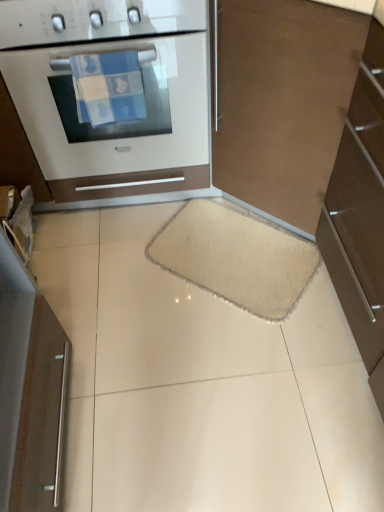
In order to face beige fuzzy mat at center, should I rotate leftwards or rightwards?

You should rotate right by 5.281 degrees.

You are a GUI agent. You are given a task and a screenshot of the screen. Output one action in this format:
    pyautogui.click(x=<x>, y=<y>)
    Task: Click on the metallic silver fridge at left
    The image size is (384, 512).
    Given the screenshot: What is the action you would take?
    pyautogui.click(x=42, y=416)

Which is nearer, (354, 121) or (59, 442)?

Clearly, point (354, 121) is closer to the camera than point (59, 442).

From the image's perspective, which object appears higher, brown matte cabinet at right or metallic silver fridge at left?

From the image's view, brown matte cabinet at right is above.

Is brown matte cabinet at right at the right side of metallic silver fridge at left?

Yes, brown matte cabinet at right is to the right of metallic silver fridge at left.

Is brown matte cabinet at right wider or thinner than metallic silver fridge at left?

brown matte cabinet at right is wider than metallic silver fridge at left.

From a real-world perspective, is metallic silver fridge at left on beige fuzzy mat at center?

Yes.

Does metallic silver fridge at left have a larger size compared to beige fuzzy mat at center?

Indeed, metallic silver fridge at left has a larger size compared to beige fuzzy mat at center.

Which of these two, metallic silver fridge at left or beige fuzzy mat at center, is wider?

beige fuzzy mat at center is wider.

From a real-world perspective, who is located lower, beige fuzzy mat at center or brown matte cabinet at right?

In real-world perspective, beige fuzzy mat at center is lower.

Which of these two, beige fuzzy mat at center or brown matte cabinet at right, is thinner?

brown matte cabinet at right is thinner.

Is beige fuzzy mat at center far away from brown matte cabinet at right?

No, beige fuzzy mat at center is not far away from brown matte cabinet at right.

Find the location of a particular element. The width and height of the screenshot is (384, 512). home appliance below the brown matte cabinet at right (from a real-world perspective) is located at coordinates (111, 94).

From the image's perspective, relative to brown matte cabinet at right, is white glossy oven at upper left above or below?

Based on their image positions, white glossy oven at upper left is located above brown matte cabinet at right.

Is white glossy oven at upper left oriented towards brown matte cabinet at right?

No, white glossy oven at upper left is not aimed at brown matte cabinet at right.

Would you say white glossy oven at upper left contains brown matte cabinet at right?

No, brown matte cabinet at right is located outside of white glossy oven at upper left.

Is point (195, 263) more distant than point (31, 9)?

Yes.

Is there a large distance between beige fuzzy mat at center and white glossy oven at upper left?

They are positioned close to each other.

Does beige fuzzy mat at center appear on the left side of white glossy oven at upper left?

Incorrect, beige fuzzy mat at center is not on the left side of white glossy oven at upper left.

Between beige fuzzy mat at center and white glossy oven at upper left, which one has more height?

white glossy oven at upper left.

Which object is wider, white glossy oven at upper left or metallic silver fridge at left?

white glossy oven at upper left.

Considering the sizes of objects white glossy oven at upper left and metallic silver fridge at left in the image provided, who is smaller, white glossy oven at upper left or metallic silver fridge at left?

metallic silver fridge at left.

Considering the positions of objects white glossy oven at upper left and metallic silver fridge at left in the image provided, who is behind, white glossy oven at upper left or metallic silver fridge at left?

white glossy oven at upper left is further from the camera.

Considering the relative positions of beige fuzzy mat at center and metallic silver fridge at left in the image provided, is beige fuzzy mat at center behind metallic silver fridge at left?

Yes.

Consider the image. From the image's perspective, does beige fuzzy mat at center appear lower than metallic silver fridge at left?

No.

Who is smaller, beige fuzzy mat at center or metallic silver fridge at left?

Smaller between the two is beige fuzzy mat at center.

Which of these two, beige fuzzy mat at center or metallic silver fridge at left, stands shorter?

With less height is beige fuzzy mat at center.

I want to click on cabinetry that is in front of the metallic silver fridge at left, so click(x=360, y=214).

Find the location of a particular element. This screenshot has width=384, height=512. appliance above the beige fuzzy mat at center (from a real-world perspective) is located at coordinates 42,416.

From the picture: Based on their spatial positions, is white glossy oven at upper left or metallic silver fridge at left closer to brown matte cabinet at right?

white glossy oven at upper left.

Which object lies further to the anchor point beige fuzzy mat at center, white glossy oven at upper left or brown matte cabinet at right?

white glossy oven at upper left is positioned further to the anchor beige fuzzy mat at center.

In the scene shown: From the image, which object appears to be farther from metallic silver fridge at left, white glossy oven at upper left or brown matte cabinet at right?

Among the two, brown matte cabinet at right is located further to metallic silver fridge at left.

Consider the image. Which object lies nearer to the anchor point beige fuzzy mat at center, metallic silver fridge at left or white glossy oven at upper left?

The object closer to beige fuzzy mat at center is white glossy oven at upper left.

Estimate the real-world distances between objects in this image. Which object is further from brown matte cabinet at right, beige fuzzy mat at center or metallic silver fridge at left?

metallic silver fridge at left.

In the scene shown: Considering their positions, is brown matte cabinet at right positioned closer to metallic silver fridge at left than beige fuzzy mat at center?

beige fuzzy mat at center is closer to metallic silver fridge at left.

Which object lies further to the anchor point metallic silver fridge at left, beige fuzzy mat at center or brown matte cabinet at right?

brown matte cabinet at right.

From the image, which object appears to be farther from metallic silver fridge at left, white glossy oven at upper left or beige fuzzy mat at center?

Based on the image, white glossy oven at upper left appears to be further to metallic silver fridge at left.

Locate an element on the screen. This screenshot has width=384, height=512. doormat between white glossy oven at upper left and metallic silver fridge at left in the up-down direction is located at coordinates (236, 256).

Where is `appliance positioned between brown matte cabinet at right and beige fuzzy mat at center from near to far`? The image size is (384, 512). appliance positioned between brown matte cabinet at right and beige fuzzy mat at center from near to far is located at coordinates pyautogui.click(x=42, y=416).

Locate an element on the screen. The height and width of the screenshot is (512, 384). home appliance between metallic silver fridge at left and brown matte cabinet at right from left to right is located at coordinates (111, 94).

Image resolution: width=384 pixels, height=512 pixels. I want to click on home appliance between brown matte cabinet at right and beige fuzzy mat at center from front to back, so click(111, 94).